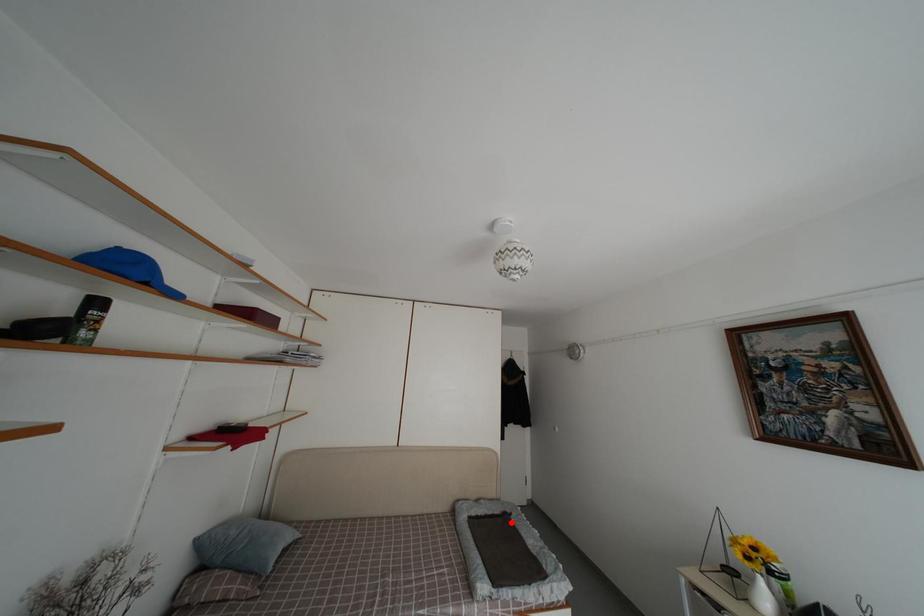
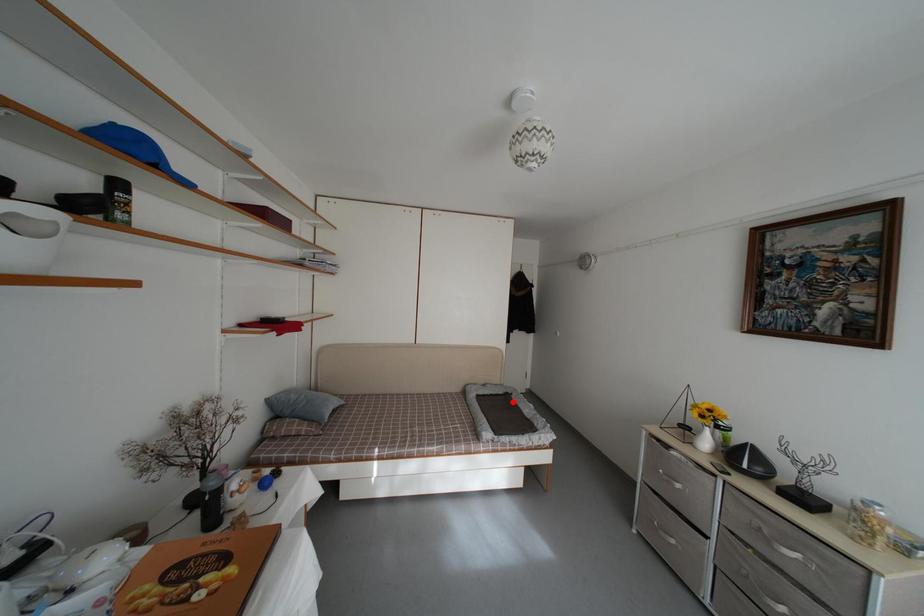
I am providing you with two images of the same scene from different viewpoints. A red point is marked on the first image and another point is marked on the second image. Is the red point in image1 aligned with the point shown in image2?

Yes